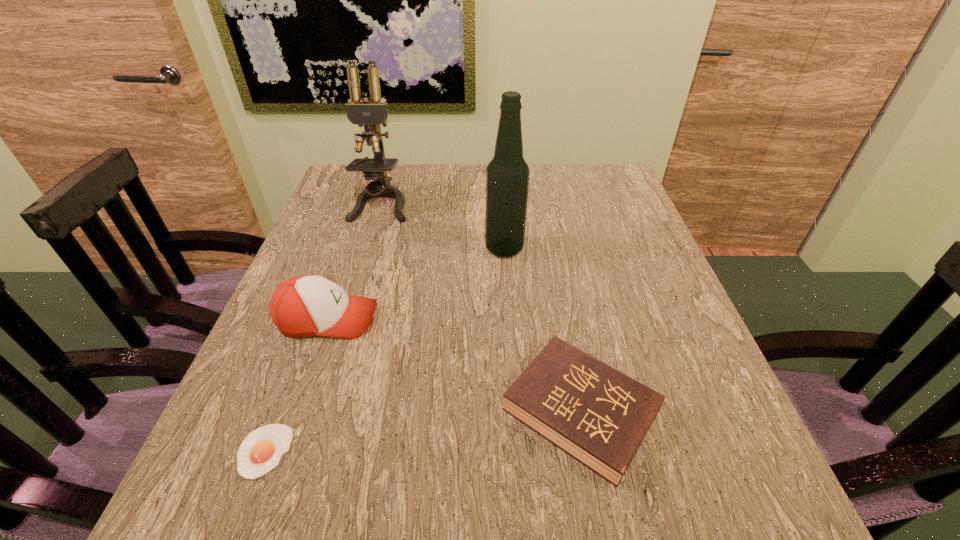
At what (x,y) coordinates should I click in order to perform the action: click on vacant point located between the alcohol and the third shortest object. Please return your answer as a coordinate pair (x, y). The height and width of the screenshot is (540, 960). Looking at the image, I should click on (416, 284).

You are a GUI agent. You are given a task and a screenshot of the screen. Output one action in this format:
    pyautogui.click(x=<x>, y=<y>)
    Task: Click on the vacant region between the second farthest object and the farthest object
    
    Given the screenshot: What is the action you would take?
    pyautogui.click(x=443, y=226)

Image resolution: width=960 pixels, height=540 pixels. In order to click on vacant area that lies between the baseball cap and the shortest object in this screenshot , I will do `click(296, 385)`.

This screenshot has width=960, height=540. Identify the location of free space between the hardback book and the alcohol. (542, 330).

I want to click on free spot between the shortest object and the hardback book, so click(x=422, y=431).

Find the location of `free space between the fourth nearest object and the second shortest object`. free space between the fourth nearest object and the second shortest object is located at coordinates (542, 330).

The width and height of the screenshot is (960, 540). Find the location of `empty space that is in between the egg yolk and the alcohol`. empty space that is in between the egg yolk and the alcohol is located at coordinates (384, 350).

I want to click on vacant area between the hardback book and the microscope, so click(481, 307).

Point out which object is positioned as the nearest to the alcohol. Please provide its 2D coordinates. Your answer should be formatted as a tuple, i.e. [(x, y)], where the tuple contains the x and y coordinates of a point satisfying the conditions above.

[(371, 114)]

Select which object appears as the third closest to the baseball cap. Please provide its 2D coordinates. Your answer should be formatted as a tuple, i.e. [(x, y)], where the tuple contains the x and y coordinates of a point satisfying the conditions above.

[(507, 175)]